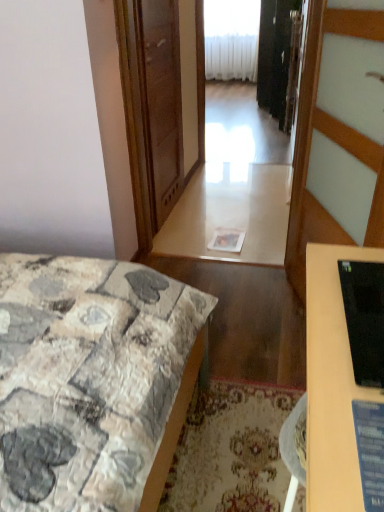
Where is `vacant space situated above carpeted mat at lower center (from a real-world perspective)`? The image size is (384, 512). vacant space situated above carpeted mat at lower center (from a real-world perspective) is located at coordinates (234, 456).